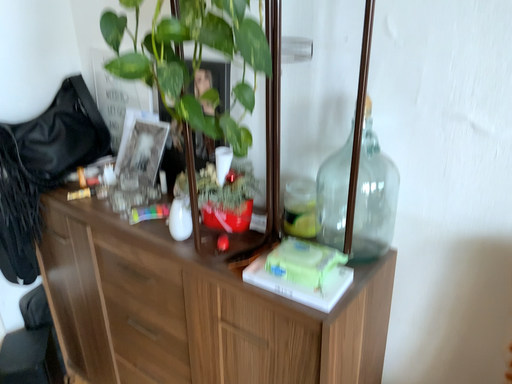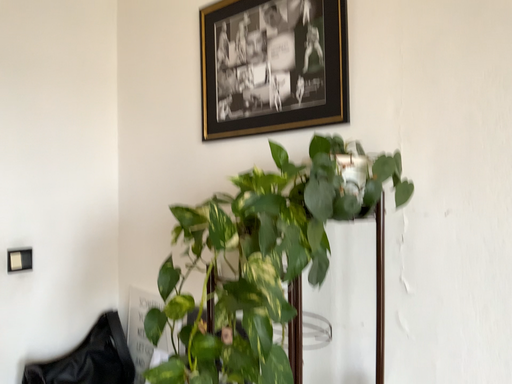
Question: Which way did the camera rotate in the video?

Choices:
 (A) rotated upward
 (B) rotated downward

Answer: (A)